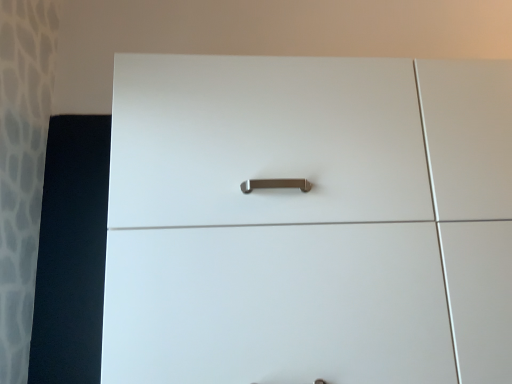
Where is `white glossy cupboard at center`? white glossy cupboard at center is located at coordinates [309, 221].

What do you see at coordinates (309, 221) in the screenshot? The image size is (512, 384). I see `white glossy cupboard at center` at bounding box center [309, 221].

This screenshot has width=512, height=384. In order to click on white glossy cupboard at center in this screenshot , I will do coord(309,221).